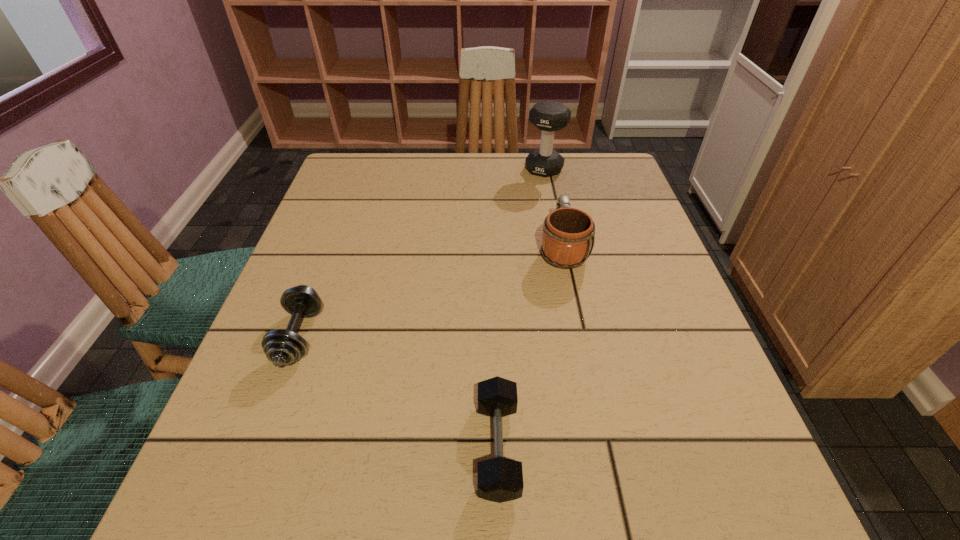
The height and width of the screenshot is (540, 960). Find the location of `the tallest dumbbell`. the tallest dumbbell is located at coordinates (549, 116).

Where is `the tallest object`? the tallest object is located at coordinates (549, 116).

The height and width of the screenshot is (540, 960). Find the location of `the second tallest object`. the second tallest object is located at coordinates (568, 234).

Identify the location of mug. The height and width of the screenshot is (540, 960). (568, 234).

The height and width of the screenshot is (540, 960). I want to click on the second nearest object, so click(x=282, y=347).

You are a GUI agent. You are given a task and a screenshot of the screen. Output one action in this format:
    pyautogui.click(x=<x>, y=<y>)
    Task: Click on the leftmost dumbbell
    The image size is (960, 540).
    Given the screenshot: What is the action you would take?
    pyautogui.click(x=282, y=347)

This screenshot has height=540, width=960. I want to click on the nearest dumbbell, so click(x=499, y=479).

I want to click on the nearest object, so click(x=499, y=479).

Image resolution: width=960 pixels, height=540 pixels. Identify the location of vacant space positioned 0.050m on the right of the tallest object. (581, 169).

Identify the location of vacant space located 0.070m on the side of the mug with the handle. The image size is (960, 540). (554, 208).